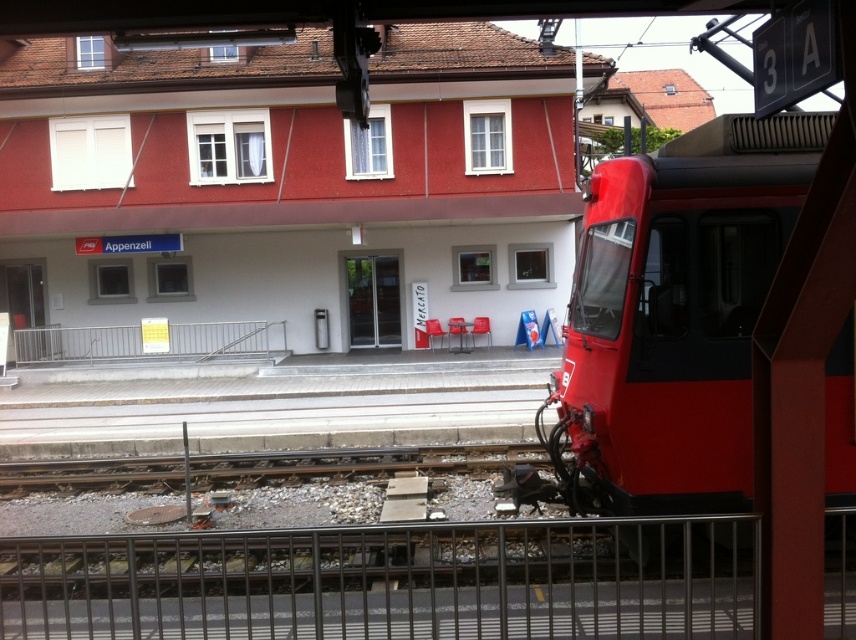
Question: Which object is closer to the camera taking this photo?

Choices:
 (A) metal at lower center
 (B) metallic gray rail at center
 (C) matte red train at right

Answer: (A)

Question: Is matte red train at right positioned at the back of metallic gray rail at center?

Choices:
 (A) no
 (B) yes

Answer: (A)

Question: Is metal at lower center above matte red train at right?

Choices:
 (A) yes
 (B) no

Answer: (B)

Question: Among these points, which one is farthest from the camera?

Choices:
 (A) (631, 236)
 (B) (275, 586)

Answer: (B)

Question: Which of the following is the closest to the observer?

Choices:
 (A) metal at lower center
 (B) matte red train at right
 (C) metallic gray rail at center

Answer: (A)

Question: Does matte red train at right have a greater width compared to metallic gray rail at center?

Choices:
 (A) no
 (B) yes

Answer: (A)